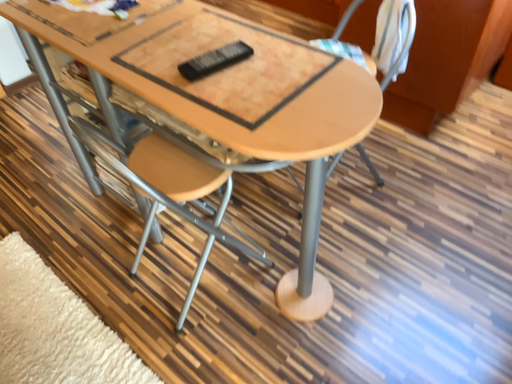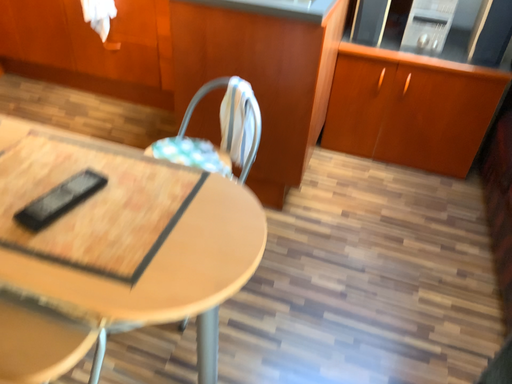
Question: How did the camera likely rotate when shooting the video?

Choices:
 (A) rotated upward
 (B) rotated downward

Answer: (A)